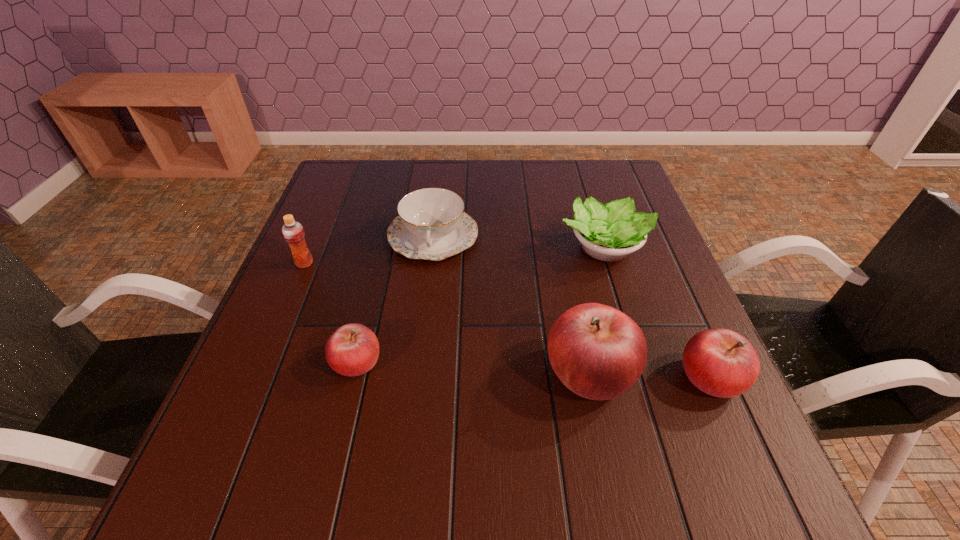
Please point a space for a new apple to maintain equal intervals. Please provide its 2D coordinates. Your answer should be formatted as a tuple, i.e. [(x, y)], where the tuple contains the x and y coordinates of a point satisfying the conditions above.

[(472, 367)]